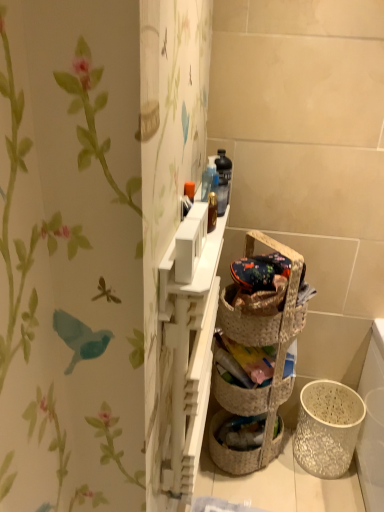
The height and width of the screenshot is (512, 384). Describe the element at coordinates (186, 364) in the screenshot. I see `white matte cabinet at upper center` at that location.

Find the location of `white matte cabinet at upper center`. white matte cabinet at upper center is located at coordinates point(186,364).

The width and height of the screenshot is (384, 512). What do you see at coordinates (261, 315) in the screenshot?
I see `woven brown picnic basket at center` at bounding box center [261, 315].

The image size is (384, 512). Identify the location of white textured basket at lower right, the second basket container positioned from the left. (327, 428).

Where is `white matte cabinet at upper center`? white matte cabinet at upper center is located at coordinates (186, 364).

Based on the photo, how many degrees apart are the facing directions of white matte cabinet at upper center and white textured basket at lower right, positioned as the 2th basket container in top-to-bottom order?

90.1 degrees.

Relative to white textured basket at lower right, the second basket container positioned from the left, is white matte cabinet at upper center in front or behind?

white matte cabinet at upper center is positioned closer to the viewer than white textured basket at lower right, the second basket container positioned from the left.

Who is bigger, white matte cabinet at upper center or white textured basket at lower right, the 1th basket container from the right?

With larger size is white matte cabinet at upper center.

Visually, is white matte cabinet at upper center positioned to the left or to the right of white textured basket at lower right, the 1th basket container from the right?

From the image, it's evident that white matte cabinet at upper center is to the left of white textured basket at lower right, the 1th basket container from the right.

Is woven brown picnic basket at center situated inside white matte cabinet at upper center or outside?

woven brown picnic basket at center lies outside white matte cabinet at upper center.

What's the angular difference between woven brown picnic basket at center and white matte cabinet at upper center's facing directions?

The angle between the facing direction of woven brown picnic basket at center and the facing direction of white matte cabinet at upper center is 44 degrees.

From a real-world perspective, is woven brown picnic basket at center physically located above or below white matte cabinet at upper center?

Clearly, from a real-world perspective, woven brown picnic basket at center is above white matte cabinet at upper center.

Between point (274, 334) and point (175, 391), which one is positioned in front?

The point (175, 391) is closer to the camera.

Between white textured basket at lower right, the 1th basket container from the right, and white matte cabinet at upper center, which one has smaller size?

Smaller between the two is white textured basket at lower right, the 1th basket container from the right.

Can you tell me how much white textured basket at lower right, positioned as the 2th basket container in top-to-bottom order, and white matte cabinet at upper center differ in facing direction?

There is a 90.1-degree angle between the facing directions of white textured basket at lower right, positioned as the 2th basket container in top-to-bottom order, and white matte cabinet at upper center.

Is white textured basket at lower right, the second basket container positioned from the left, thinner than white matte cabinet at upper center?

No, white textured basket at lower right, the second basket container positioned from the left, is not thinner than white matte cabinet at upper center.

Considering the points (331, 458) and (206, 269), which point is in front, point (331, 458) or point (206, 269)?

The point (206, 269) is closer to the camera.

Is point (334, 386) behind point (263, 412)?

Yes, it is.

Relative to woven straw basket at center, which is counted as the 2th basket container, starting from the right, is white textured basket at lower right, which ranks as the first basket container in bottom-to-top order, in front or behind?

Clearly, white textured basket at lower right, which ranks as the first basket container in bottom-to-top order, is behind woven straw basket at center, which is counted as the 2th basket container, starting from the right.

From a real-world perspective, is woven brown picnic basket at center under white textured basket at lower right, positioned as the 2th basket container in top-to-bottom order?

No, from a real-world perspective, woven brown picnic basket at center is not below white textured basket at lower right, positioned as the 2th basket container in top-to-bottom order.

Based on their sizes in the image, would you say woven brown picnic basket at center is bigger or smaller than white textured basket at lower right, the second basket container positioned from the left?

In the image, woven brown picnic basket at center appears to be smaller than white textured basket at lower right, the second basket container positioned from the left.

Is woven brown picnic basket at center not close to white textured basket at lower right, which ranks as the first basket container in bottom-to-top order?

woven brown picnic basket at center is near white textured basket at lower right, which ranks as the first basket container in bottom-to-top order, not far away.

The height and width of the screenshot is (512, 384). I want to click on picnic basket on the left of the white textured basket at lower right, positioned as the 2th basket container in top-to-bottom order, so click(x=261, y=315).

Is woven brown picnic basket at center inside the boundaries of woven straw basket at center, placed as the 1th basket container when sorted from top to bottom, or outside?

woven brown picnic basket at center is outside woven straw basket at center, placed as the 1th basket container when sorted from top to bottom.

Locate an element on the screen. The image size is (384, 512). basket container on the left of the woven brown picnic basket at center is located at coordinates (254, 391).

From a real-world perspective, relative to woven straw basket at center, arranged as the second basket container when ordered from the bottom, is woven brown picnic basket at center vertically above or below?

woven brown picnic basket at center is situated higher than woven straw basket at center, arranged as the second basket container when ordered from the bottom, in the real world.

Is there a large distance between woven brown picnic basket at center and woven straw basket at center, positioned as the first basket container in left-to-right order?

→ No, woven brown picnic basket at center is in close proximity to woven straw basket at center, positioned as the first basket container in left-to-right order.

Does white matte cabinet at upper center contain woven brown picnic basket at center?

Actually, woven brown picnic basket at center is outside white matte cabinet at upper center.

Is white matte cabinet at upper center positioned before woven brown picnic basket at center?

Yes, the depth of white matte cabinet at upper center is less than that of woven brown picnic basket at center.

Is white matte cabinet at upper center taller or shorter than woven brown picnic basket at center?

Considering their sizes, white matte cabinet at upper center has more height than woven brown picnic basket at center.

Is white matte cabinet at upper center at the left side of woven brown picnic basket at center?

Indeed, white matte cabinet at upper center is positioned on the left side of woven brown picnic basket at center.

Identify the location of cabinet to the left of white textured basket at lower right, positioned as the 2th basket container in top-to-bottom order. (186, 364).

Where is `picnic basket located behind the white matte cabinet at upper center`? This screenshot has width=384, height=512. picnic basket located behind the white matte cabinet at upper center is located at coordinates (261, 315).

Based on their spatial positions, is woven straw basket at center, positioned as the first basket container in left-to-right order, or woven brown picnic basket at center closer to white textured basket at lower right, the 1th basket container from the right?

The object closer to white textured basket at lower right, the 1th basket container from the right, is woven straw basket at center, positioned as the first basket container in left-to-right order.

From the image, which object appears to be farther from white textured basket at lower right, the second basket container positioned from the left, white matte cabinet at upper center or woven straw basket at center, positioned as the first basket container in left-to-right order?

white matte cabinet at upper center lies further to white textured basket at lower right, the second basket container positioned from the left, than the other object.

Estimate the real-world distances between objects in this image. Which object is further from woven straw basket at center, placed as the 1th basket container when sorted from top to bottom, woven brown picnic basket at center or white textured basket at lower right, which ranks as the first basket container in bottom-to-top order?

The object further to woven straw basket at center, placed as the 1th basket container when sorted from top to bottom, is white textured basket at lower right, which ranks as the first basket container in bottom-to-top order.

When comparing their distances from white matte cabinet at upper center, does white textured basket at lower right, the second basket container positioned from the left, or woven brown picnic basket at center seem further?

Among the two, white textured basket at lower right, the second basket container positioned from the left, is located further to white matte cabinet at upper center.

Considering their positions, is white matte cabinet at upper center positioned further to woven brown picnic basket at center than white textured basket at lower right, the 1th basket container from the right?

white textured basket at lower right, the 1th basket container from the right.

When comparing their distances from white textured basket at lower right, positioned as the 2th basket container in top-to-bottom order, does woven brown picnic basket at center or woven straw basket at center, placed as the 1th basket container when sorted from top to bottom, seem further?

Among the two, woven brown picnic basket at center is located further to white textured basket at lower right, positioned as the 2th basket container in top-to-bottom order.

From the image, which object appears to be farther from woven brown picnic basket at center, white textured basket at lower right, the second basket container positioned from the left, or white matte cabinet at upper center?

white textured basket at lower right, the second basket container positioned from the left, lies further to woven brown picnic basket at center than the other object.

When comparing their distances from white matte cabinet at upper center, does woven brown picnic basket at center or white textured basket at lower right, the second basket container positioned from the left, seem further?

white textured basket at lower right, the second basket container positioned from the left, is positioned further to the anchor white matte cabinet at upper center.

Locate an element on the screen. The width and height of the screenshot is (384, 512). picnic basket between white matte cabinet at upper center and woven straw basket at center, arranged as the second basket container when ordered from the bottom, in the front-back direction is located at coordinates (261, 315).

Locate an element on the screen. picnic basket between white matte cabinet at upper center and white textured basket at lower right, which ranks as the first basket container in bottom-to-top order, from front to back is located at coordinates (261, 315).

Find the location of a particular element. This screenshot has height=512, width=384. basket container between woven brown picnic basket at center and white textured basket at lower right, the 1th basket container from the right, from top to bottom is located at coordinates (254, 391).

You are a GUI agent. You are given a task and a screenshot of the screen. Output one action in this format:
    pyautogui.click(x=<x>, y=<y>)
    Task: Click on the basket container located between white matte cabinet at upper center and white textured basket at lower right, which ranks as the first basket container in bottom-to-top order, in the depth direction
    Image resolution: width=384 pixels, height=512 pixels.
    Given the screenshot: What is the action you would take?
    pyautogui.click(x=254, y=391)